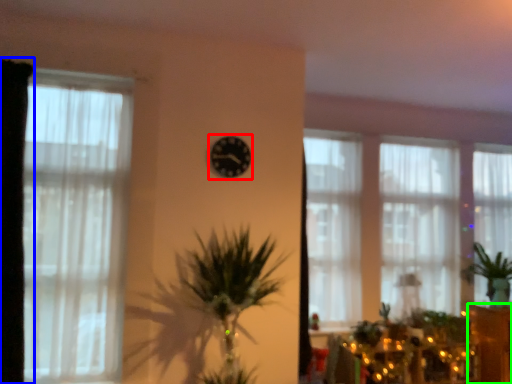
Question: Which object is positioned closest to clock (highlighted by a red box)? Select from curtain (highlighted by a blue box) and furniture (highlighted by a green box).

Choices:
 (A) curtain
 (B) furniture

Answer: (A)